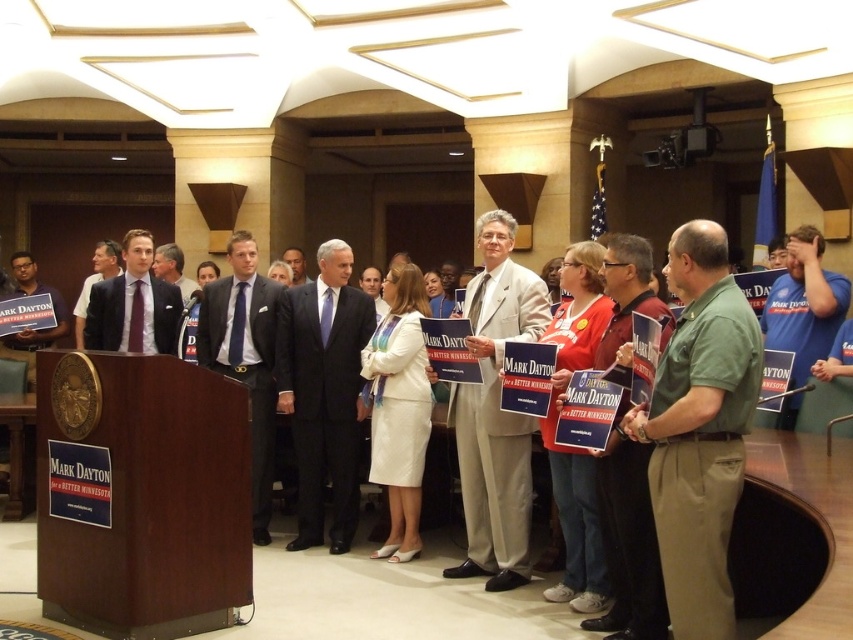
You are a photographer at the event and need to capture a clear photo of the speaker. The light beige suit at center and the matte purple tie at left are both in your frame. Which object should you focus on to ensure the speaker is sharp?

You should focus on the light beige suit at center because it is in front of the matte purple tie at left, making it closer to the camera and thus easier to capture sharply.